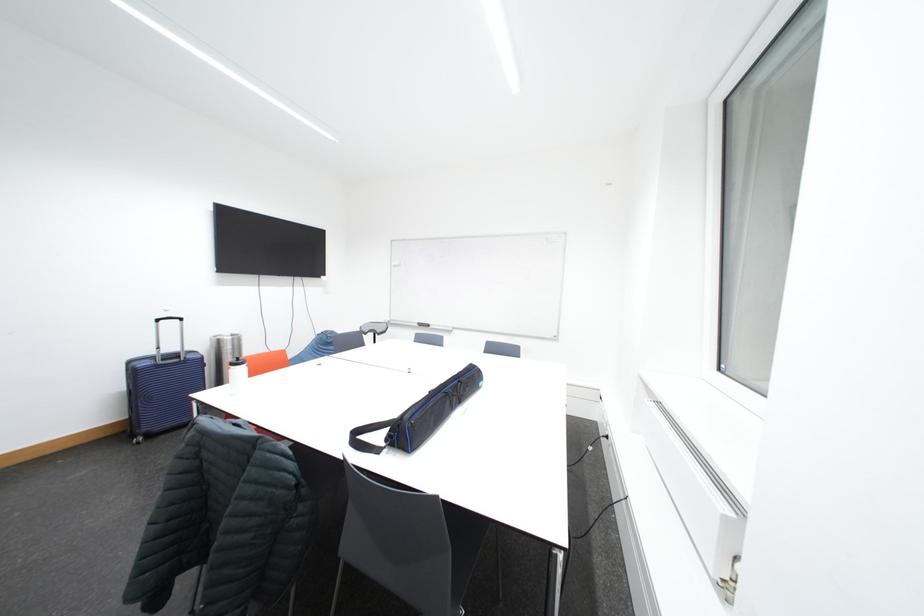
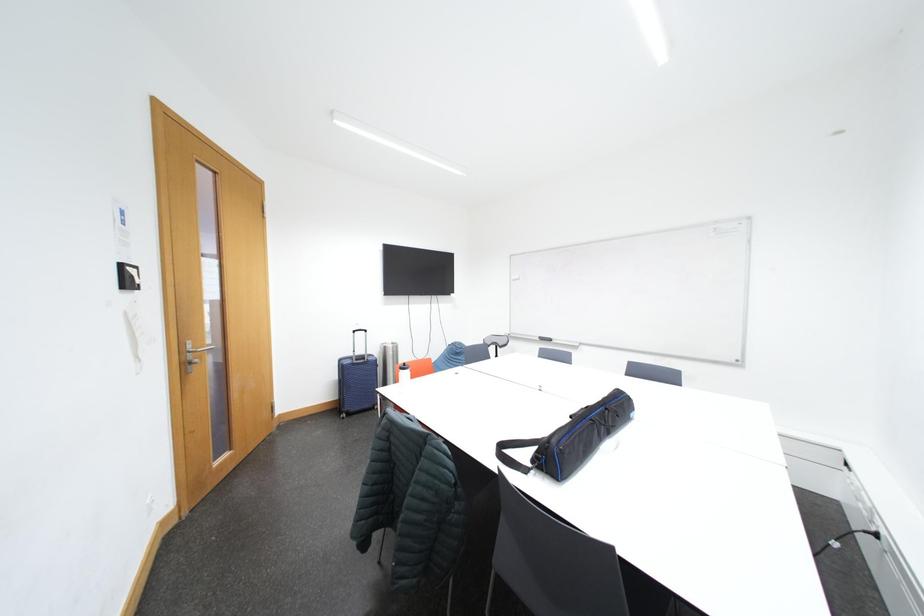
Question: The camera is either moving clockwise (left) or counter-clockwise (right) around the object. The first image is from the beginning of the video and the second image is from the end. Is the camera moving left or right when shooting the video?

Choices:
 (A) Left
 (B) Right

Answer: (B)